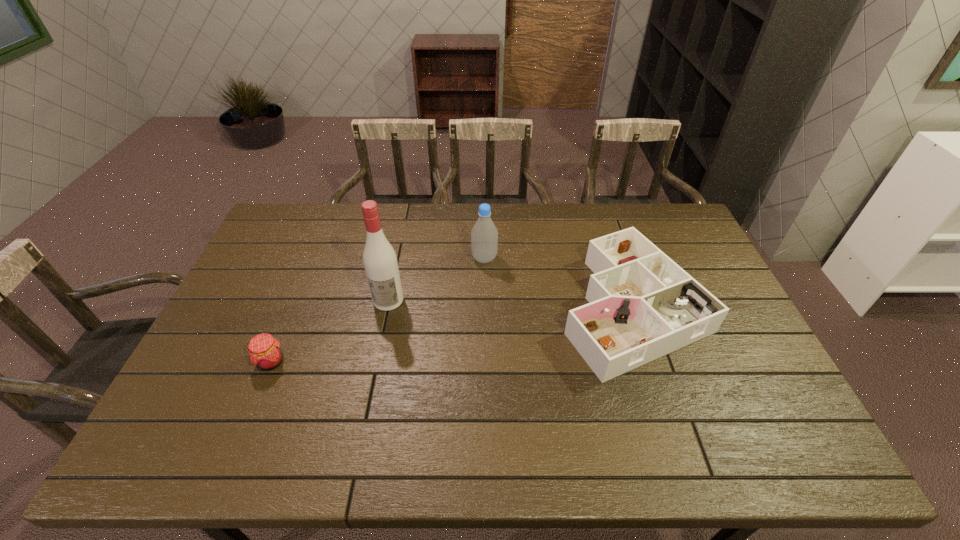
At what (x,y) coordinates should I click in order to perform the action: click on object positioned at the left edge. Please return your answer as a coordinate pair (x, y). Looking at the image, I should click on (265, 352).

At what (x,y) coordinates should I click in order to perform the action: click on object that is positioned at the right edge. Please return your answer as a coordinate pair (x, y). Looking at the image, I should click on 642,305.

The height and width of the screenshot is (540, 960). Find the location of `blank space at the far edge of the desktop`. blank space at the far edge of the desktop is located at coordinates (638, 226).

This screenshot has height=540, width=960. Find the location of `blank space at the near edge of the desktop`. blank space at the near edge of the desktop is located at coordinates (727, 436).

Image resolution: width=960 pixels, height=540 pixels. What are the coordinates of `vacant area at the left edge` in the screenshot? It's located at (262, 287).

Find the location of `free space at the right edge of the desktop`. free space at the right edge of the desktop is located at coordinates (783, 410).

Locate an element on the screen. Image resolution: width=960 pixels, height=540 pixels. vacant area at the far left corner is located at coordinates (292, 224).

At what (x,y) coordinates should I click in order to perform the action: click on free point at the far right corner. Please return your answer as a coordinate pair (x, y). Looking at the image, I should click on (668, 243).

I want to click on free space between the dollhouse and the jam, so click(x=451, y=334).

Identify the location of vacant area that lies between the tallest object and the rightmost object. The height and width of the screenshot is (540, 960). (510, 303).